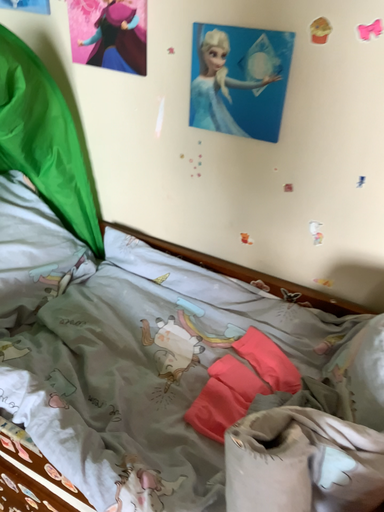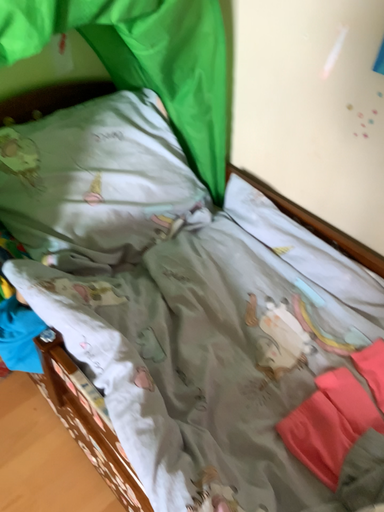
Question: Which way did the camera rotate in the video?

Choices:
 (A) rotated upward
 (B) rotated downward

Answer: (B)